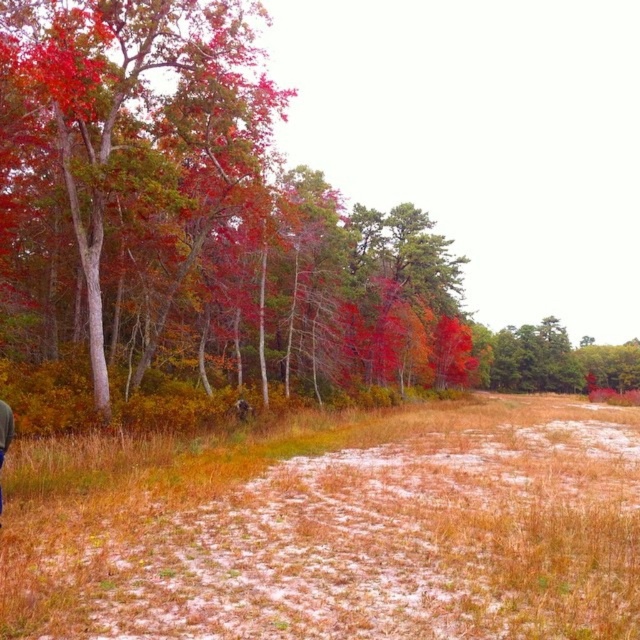
Does point (444, 536) lie in front of point (8, 416)?

No, (444, 536) is further to viewer.

Between brown grass at center and denim jacket at lower left, which one has more height?

brown grass at center is taller.

Is point (390, 637) more distant than point (10, 420)?

No, (390, 637) is in front of (10, 420).

In order to click on brown grass at center in this screenshot , I will do `click(336, 529)`.

Is point (64, 228) farther from camera compared to point (13, 428)?

That is True.

Between point (104, 0) and point (1, 422), which one is positioned behind?

Point (104, 0)

The height and width of the screenshot is (640, 640). In order to click on autumn leaves at left in this screenshot , I will do `click(196, 216)`.

Between autumn leaves at left and brown grass at center, which one is positioned higher?

autumn leaves at left

Can you confirm if autumn leaves at left is shorter than brown grass at center?

In fact, autumn leaves at left may be taller than brown grass at center.

The width and height of the screenshot is (640, 640). What do you see at coordinates (196, 216) in the screenshot?
I see `autumn leaves at left` at bounding box center [196, 216].

Find the location of a particular element. autumn leaves at left is located at coordinates 196,216.